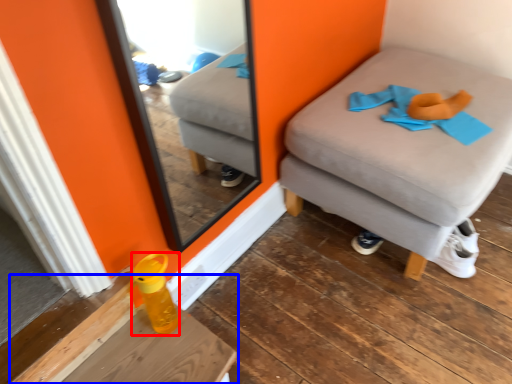
Question: Which point is further to the camera, bottle (highlighted by a red box) or table (highlighted by a blue box)?

Choices:
 (A) bottle
 (B) table

Answer: (A)